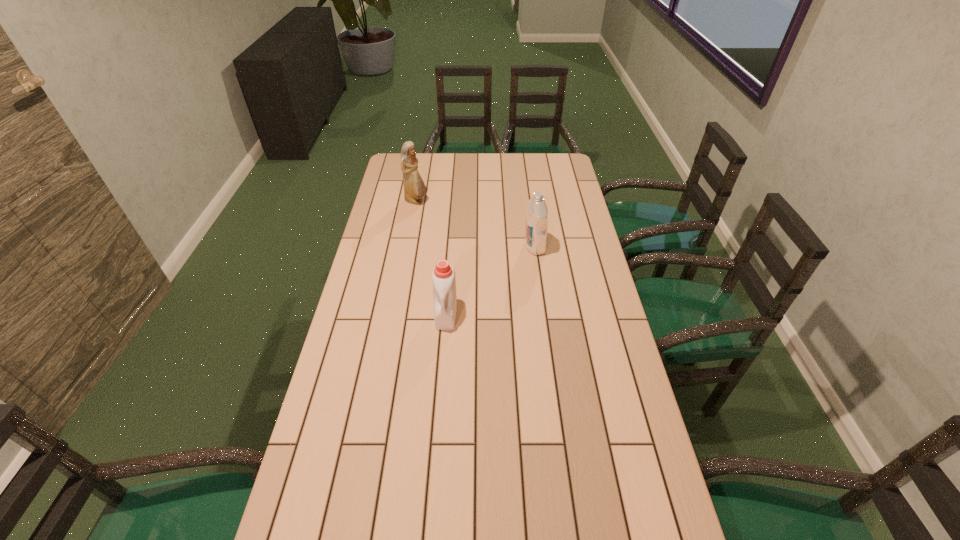
The image size is (960, 540). In order to click on figurine in this screenshot , I will do point(414,188).

Find the location of a particular element. the farthest object is located at coordinates (414, 188).

Locate an element on the screen. The width and height of the screenshot is (960, 540). the second nearest object is located at coordinates (537, 212).

Locate an element on the screen. Image resolution: width=960 pixels, height=540 pixels. the farther detergent is located at coordinates (537, 212).

Where is `the left detergent`? the left detergent is located at coordinates (443, 277).

Identify the location of the nearer detergent. The width and height of the screenshot is (960, 540). (443, 277).

Where is `vacant region located on the front-facing side of the farthest object`? vacant region located on the front-facing side of the farthest object is located at coordinates (445, 201).

Locate an element on the screen. Image resolution: width=960 pixels, height=540 pixels. vacant region located 0.260m on the back of the second farthest object is located at coordinates (528, 199).

Find the location of a particular element. This screenshot has width=960, height=540. vacant space located on the handle side of the second object from left to right is located at coordinates (442, 377).

In order to click on object located in the left edge section of the desktop in this screenshot , I will do `click(414, 188)`.